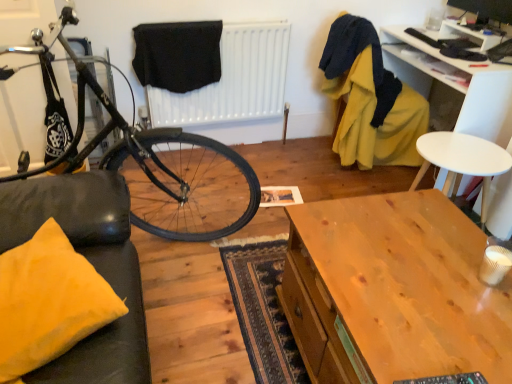
The image size is (512, 384). Find the location of `free spot in front of yellow fabric armchair at upper right`. free spot in front of yellow fabric armchair at upper right is located at coordinates (354, 182).